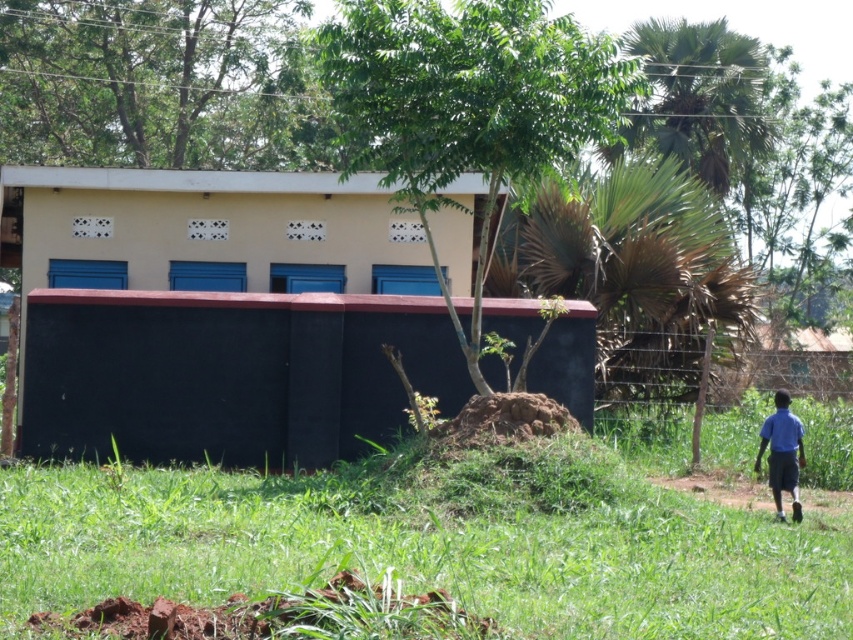
How distant is green grassy at lower right from blue fabric shirt at right?

green grassy at lower right is 13.50 feet from blue fabric shirt at right.

Does point (111, 595) come closer to viewer compared to point (772, 433)?

Yes, it is.

Locate an element on the screen. Image resolution: width=853 pixels, height=640 pixels. green grassy at lower right is located at coordinates tap(428, 545).

In the scene shown: Between yellow matte building at center and blue fabric shirt at right, which one has more height?

blue fabric shirt at right

Describe the element at coordinates (221, 314) in the screenshot. I see `yellow matte building at center` at that location.

Which is in front, point (195, 364) or point (775, 488)?

Point (775, 488) is more forward.

Image resolution: width=853 pixels, height=640 pixels. What are the coordinates of `yellow matte building at center` in the screenshot? It's located at coord(221,314).

Is yellow matte building at center to the right of green grassy at lower right from the viewer's perspective?

No, yellow matte building at center is not to the right of green grassy at lower right.

Which of these two, yellow matte building at center or green grassy at lower right, stands taller?

Standing taller between the two is yellow matte building at center.

What do you see at coordinates (221, 314) in the screenshot? The image size is (853, 640). I see `yellow matte building at center` at bounding box center [221, 314].

The height and width of the screenshot is (640, 853). What are the coordinates of `yellow matte building at center` in the screenshot? It's located at (221, 314).